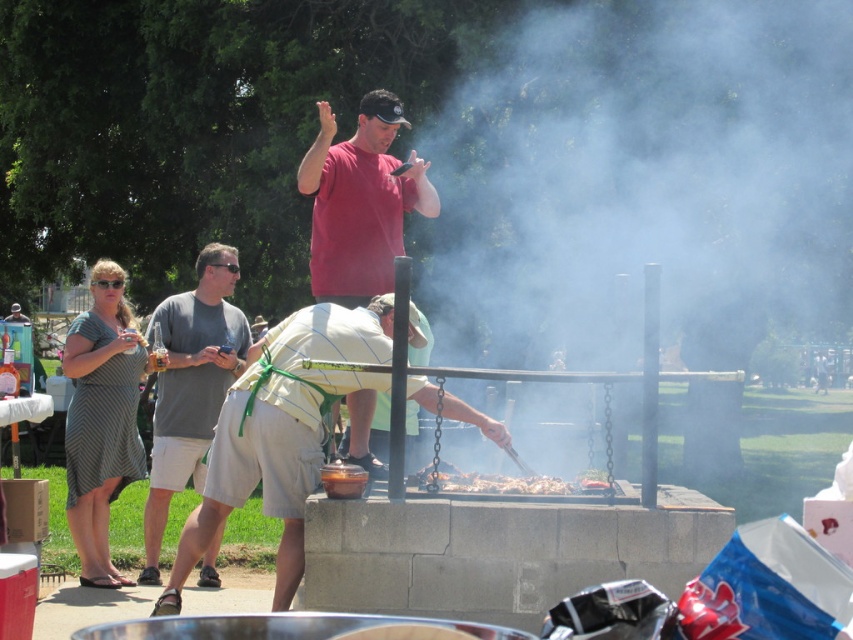
Question: Is light yellow fabric apron at center further to camera compared to gray cotton t-shirt at left?

Choices:
 (A) no
 (B) yes

Answer: (A)

Question: Which object appears closest to the camera in this image?

Choices:
 (A) matte red shirt at center
 (B) gray cotton t-shirt at left
 (C) charcoal briquettes at center
 (D) light yellow fabric apron at center

Answer: (D)

Question: Among these points, which one is farthest from the camera?

Choices:
 (A) (566, 484)
 (B) (422, 376)

Answer: (A)

Question: Can you confirm if light yellow fabric apron at center is positioned above green rubber goggles at upper center?

Choices:
 (A) yes
 (B) no

Answer: (B)

Question: Does light yellow fabric apron at center have a lesser width compared to charcoal briquettes at center?

Choices:
 (A) yes
 (B) no

Answer: (B)

Question: Which of the following is the closest to the observer?

Choices:
 (A) light yellow fabric apron at center
 (B) green rubber goggles at upper center
 (C) gray cotton t-shirt at left

Answer: (A)